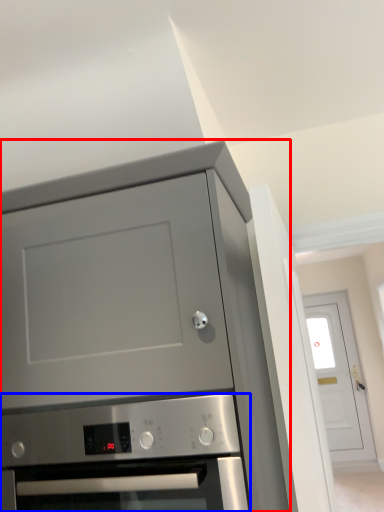
Question: Among these objects, which one is nearest to the camera, cabinetry (highlighted by a red box) or oven (highlighted by a blue box)?

Choices:
 (A) cabinetry
 (B) oven

Answer: (A)